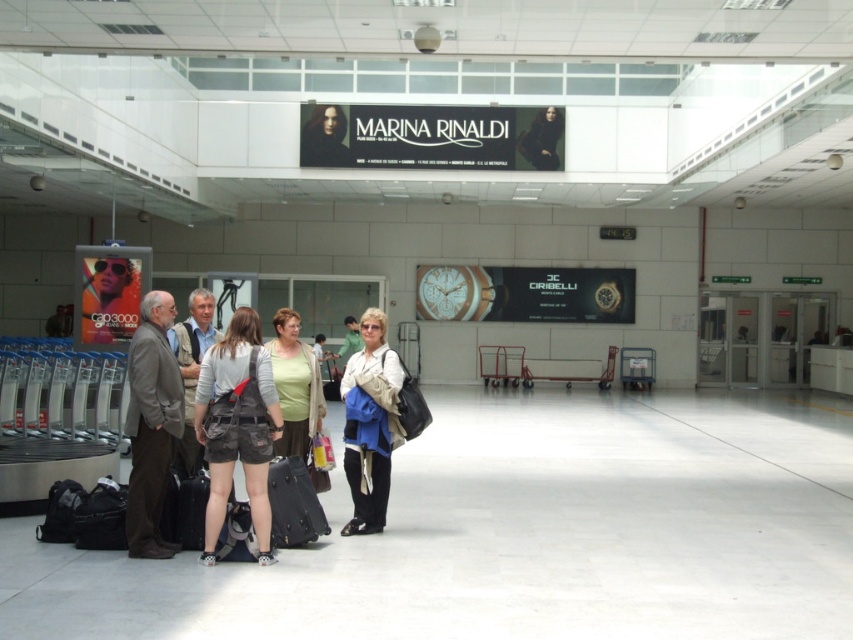
You are standing at the entrance of the airport terminal and see the scene. There is a point marked at coordinates (236, 426). What is located at that point?

The point at coordinates (236, 426) is occupied by denim shorts at center.

You are a traveler looking for your luggage. You see a denim shorts at center and a brown leather jacket at left. Which item is closer to the right side of the scene?

The denim shorts at center is closer to the right side of the scene compared to the brown leather jacket at left.

You are standing in the airport terminal and see the denim shorts at center. If you want to locate it precisely, what are its coordinates?

The denim shorts at center is located at coordinates point (236,426).